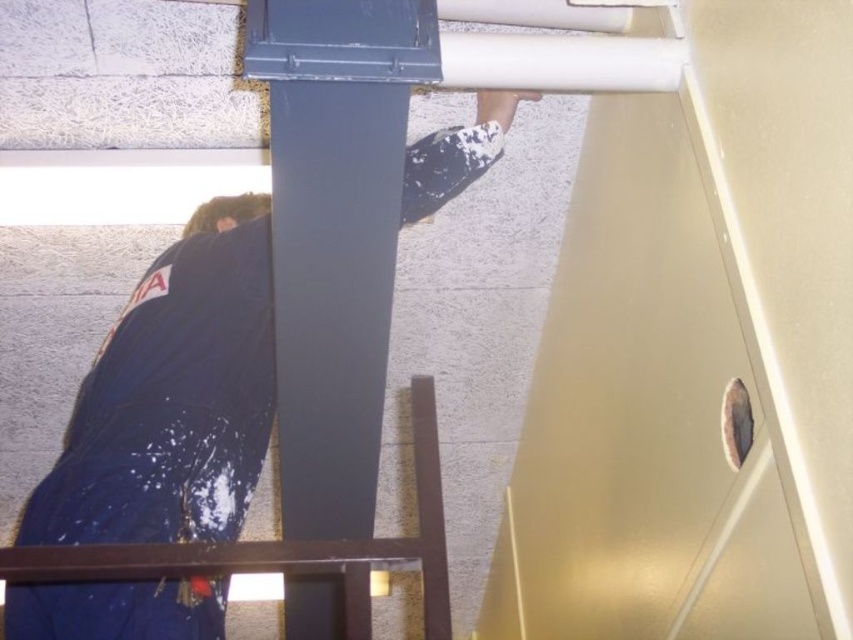
Question: Is dark blue fabric at center smaller than matte gray column at center?

Choices:
 (A) no
 (B) yes

Answer: (B)

Question: Can you confirm if dark blue fabric at center is positioned below matte gray column at center?

Choices:
 (A) no
 (B) yes

Answer: (A)

Question: Does dark blue fabric at center appear on the left side of matte gray column at center?

Choices:
 (A) no
 (B) yes

Answer: (B)

Question: Which object appears farthest from the camera in this image?

Choices:
 (A) dark blue fabric at center
 (B) matte gray column at center

Answer: (A)